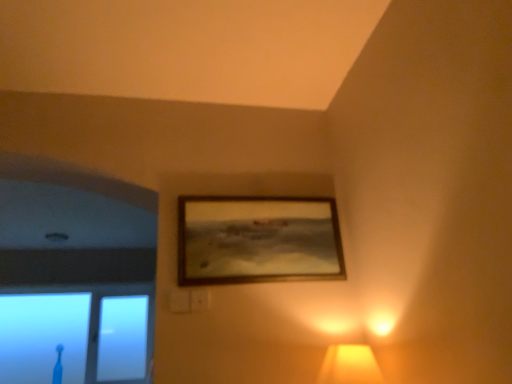
Question: Is transparent glass toothbrush at lower left placed right next to matte yellow lampshade at lower right?

Choices:
 (A) yes
 (B) no

Answer: (B)

Question: Considering the relative sizes of transparent glass toothbrush at lower left and matte yellow lampshade at lower right in the image provided, is transparent glass toothbrush at lower left bigger than matte yellow lampshade at lower right?

Choices:
 (A) no
 (B) yes

Answer: (B)

Question: Is transparent glass toothbrush at lower left far from matte yellow lampshade at lower right?

Choices:
 (A) no
 (B) yes

Answer: (B)

Question: Considering the relative sizes of transparent glass toothbrush at lower left and matte yellow lampshade at lower right in the image provided, is transparent glass toothbrush at lower left shorter than matte yellow lampshade at lower right?

Choices:
 (A) yes
 (B) no

Answer: (B)

Question: Does transparent glass toothbrush at lower left have a lesser width compared to matte yellow lampshade at lower right?

Choices:
 (A) yes
 (B) no

Answer: (A)

Question: Considering the positions of wooden frame at upper center and matte yellow lampshade at lower right in the image, is wooden frame at upper center wider or thinner than matte yellow lampshade at lower right?

Choices:
 (A) wide
 (B) thin

Answer: (B)

Question: Is point (309, 213) closer or farther from the camera than point (362, 370)?

Choices:
 (A) farther
 (B) closer

Answer: (A)

Question: In the image, is wooden frame at upper center on the left side or the right side of matte yellow lampshade at lower right?

Choices:
 (A) right
 (B) left

Answer: (B)

Question: Considering the positions of wooden frame at upper center and matte yellow lampshade at lower right in the image, is wooden frame at upper center taller or shorter than matte yellow lampshade at lower right?

Choices:
 (A) short
 (B) tall

Answer: (B)

Question: In terms of size, does matte yellow lampshade at lower right appear bigger or smaller than transparent glass toothbrush at lower left?

Choices:
 (A) small
 (B) big

Answer: (A)

Question: From the image's perspective, is matte yellow lampshade at lower right positioned above or below transparent glass toothbrush at lower left?

Choices:
 (A) above
 (B) below

Answer: (A)

Question: Is matte yellow lampshade at lower right in front of or behind transparent glass toothbrush at lower left in the image?

Choices:
 (A) front
 (B) behind

Answer: (A)

Question: Is point (324, 357) closer or farther from the camera than point (61, 319)?

Choices:
 (A) closer
 (B) farther

Answer: (A)

Question: Is point (353, 374) positioned closer to the camera than point (296, 221)?

Choices:
 (A) farther
 (B) closer

Answer: (B)

Question: In terms of height, does matte yellow lampshade at lower right look taller or shorter compared to wooden frame at upper center?

Choices:
 (A) tall
 (B) short

Answer: (B)